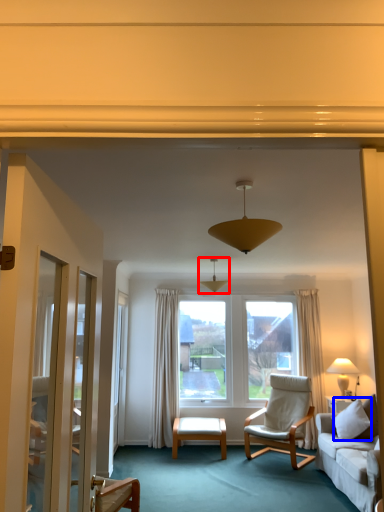
Question: Which point is further to the camera, lamp (highlighted by a red box) or pillow (highlighted by a blue box)?

Choices:
 (A) lamp
 (B) pillow

Answer: (A)